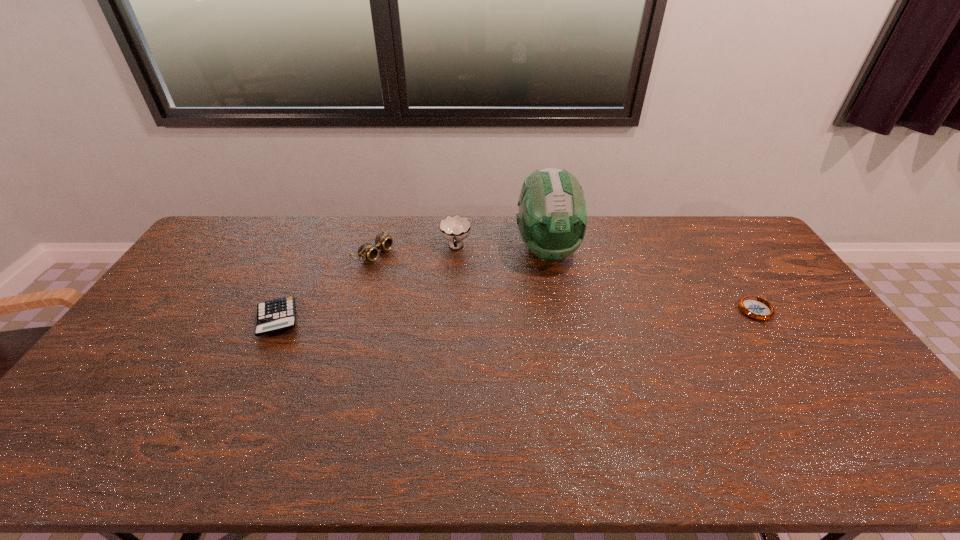
The height and width of the screenshot is (540, 960). I want to click on calculator, so pyautogui.click(x=276, y=315).

Where is `the leftmost object`? the leftmost object is located at coordinates (276, 315).

The width and height of the screenshot is (960, 540). What are the coordinates of `compass` in the screenshot? It's located at [754, 307].

Locate an element on the screen. This screenshot has height=540, width=960. the rightmost object is located at coordinates (754, 307).

You are a GUI agent. You are given a task and a screenshot of the screen. Output one action in this format:
    pyautogui.click(x=<x>, y=<y>)
    Task: Click on the fourth object from left to right
    The image size is (960, 540).
    Given the screenshot: What is the action you would take?
    pyautogui.click(x=552, y=219)

Where is `the tallest object`? This screenshot has width=960, height=540. the tallest object is located at coordinates (552, 219).

Where is `goggles`? The width and height of the screenshot is (960, 540). goggles is located at coordinates (366, 251).

This screenshot has height=540, width=960. What are the coordinates of `the fourth object from right to left` in the screenshot? It's located at (366, 251).

At what (x,y) coordinates should I click in order to perform the action: click on the third object from left to right. Please return your answer as a coordinate pair (x, y). The image size is (960, 540). Looking at the image, I should click on (455, 228).

Identify the location of cup. This screenshot has width=960, height=540. (455, 228).